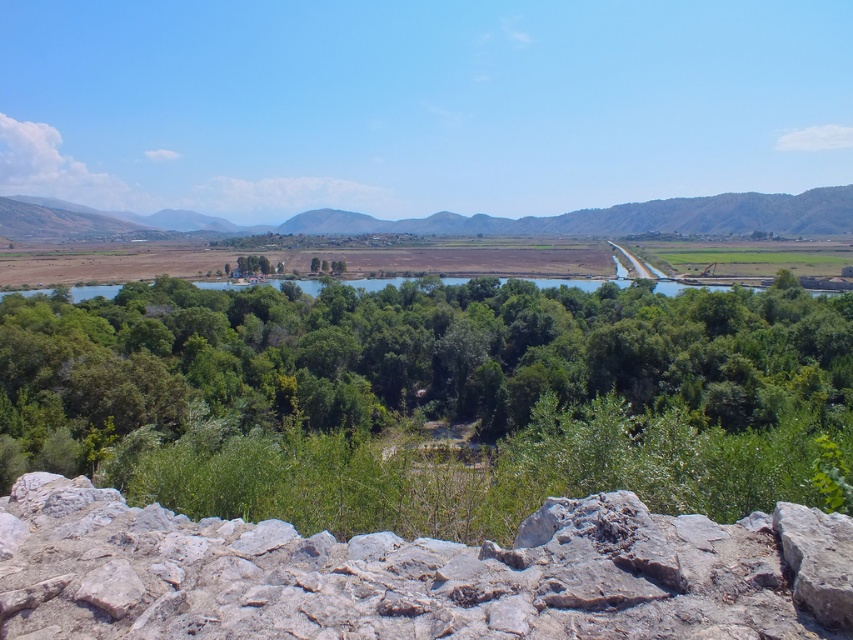
Question: Estimate the real-world distances between objects in this image. Which object is farther from the green leafy trees at center?

Choices:
 (A) brown rocky mountain at center
 (B) gray rough stone at bottom

Answer: (A)

Question: Observing the image, what is the correct spatial positioning of green leafy trees at center in reference to gray rough stone at bottom?

Choices:
 (A) right
 (B) left

Answer: (B)

Question: Does green leafy trees at center have a smaller size compared to brown rocky mountain at center?

Choices:
 (A) yes
 (B) no

Answer: (A)

Question: Estimate the real-world distances between objects in this image. Which object is farther from the green leafy trees at center?

Choices:
 (A) gray rough stone at bottom
 (B) brown rocky mountain at center

Answer: (B)

Question: In this image, where is green leafy trees at center located relative to gray rough stone at bottom?

Choices:
 (A) right
 (B) left

Answer: (B)

Question: Which of the following is the farthest from the observer?

Choices:
 (A) (131, 218)
 (B) (421, 544)
 (C) (689, 454)

Answer: (A)